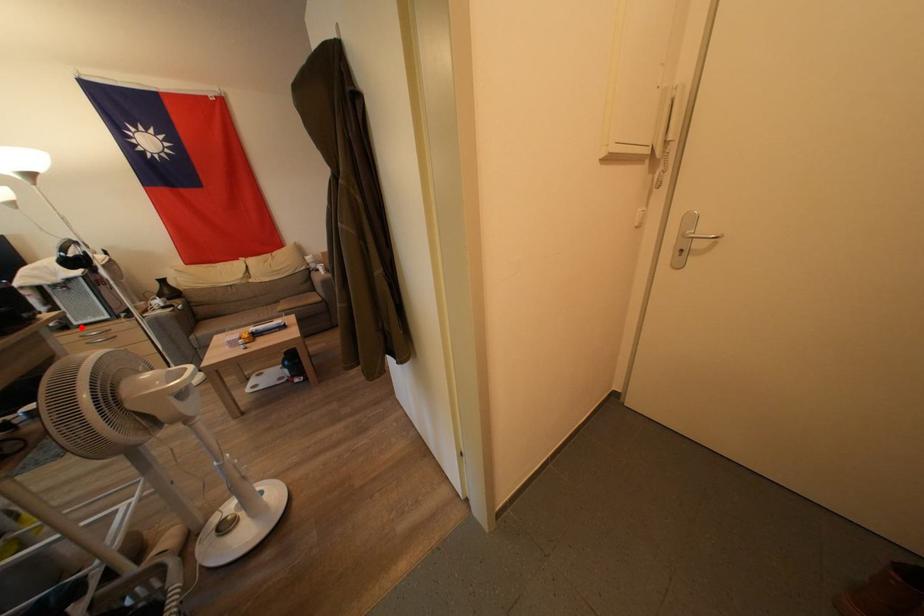
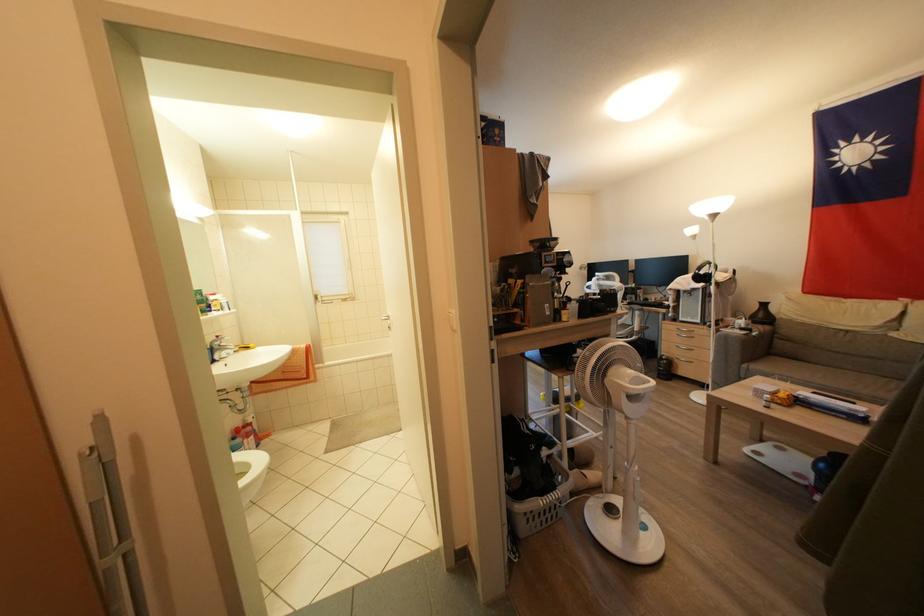
Locate, in the second image, the point that corresponds to the highlighted location in the first image.

(686, 323)